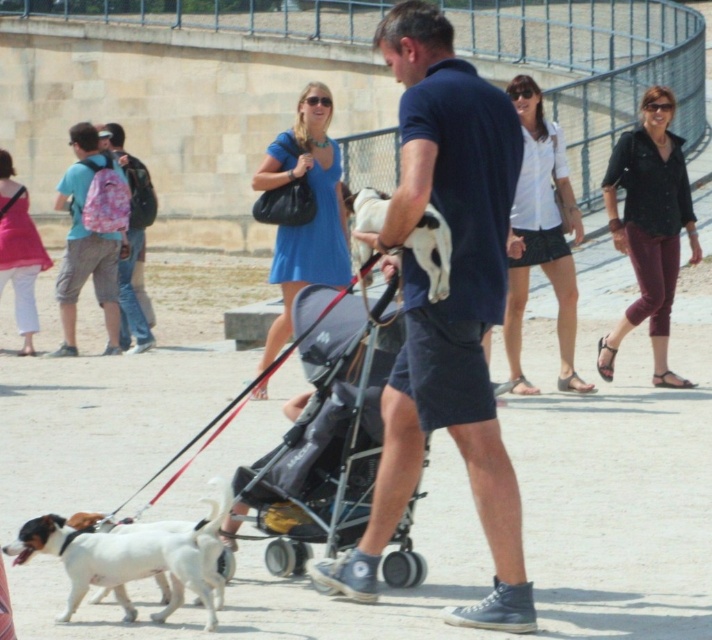
You are a photographer trying to capture a photo of the black fabric stroller at center and the pink backpack at left. Based on their positions, which object should you adjust your camera angle to focus on first if you want to include both in the frame?

The black fabric stroller at center is to the right of the pink backpack at left. To include both in the frame, you should first focus on the pink backpack at left since it is positioned to the left of the stroller, ensuring it is captured before adjusting the angle to include the stroller on the right.

You are a delivery robot that needs to deliver a package to the black fabric stroller at center. You are currently at the pink backpack at left. Can you move directly to the stroller without any obstacles?

The black fabric stroller at center and pink backpack at left are 8.76 meters apart from each other. Since there are no mentioned obstacles in the scene description, the robot can move directly to the stroller.

You are a photographer trying to capture the scene. You notice the black fabric stroller at center and the pink fabric backpack at left. Which object is positioned lower in the image?

The black fabric stroller at center is located below the pink fabric backpack at left, so it is positioned lower in the image.